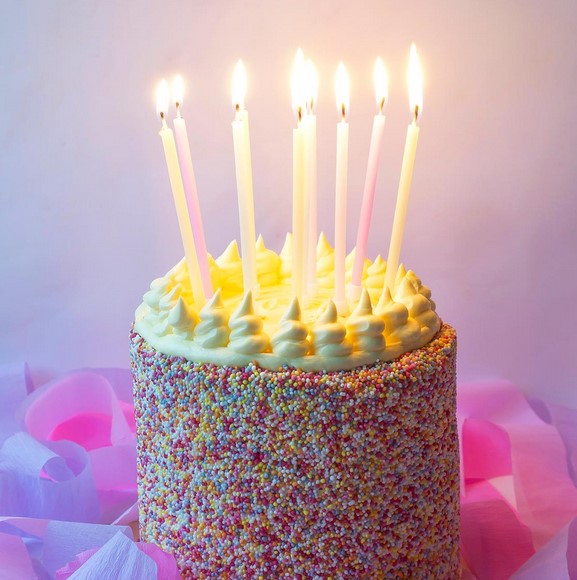
This screenshot has height=580, width=577. Identify the location of birthday candles. (175, 193), (186, 161), (239, 171), (246, 122), (302, 193), (310, 155), (339, 163), (367, 181), (402, 193).